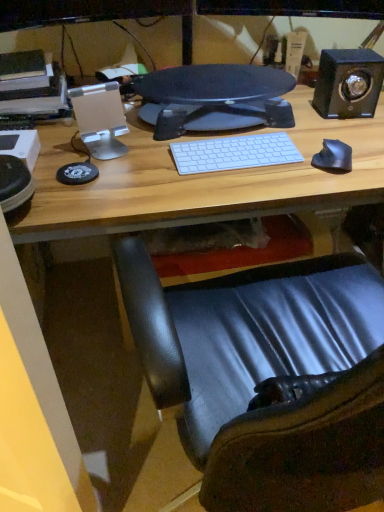
Find the location of a particular element. The width and height of the screenshot is (384, 512). free location in front of black matte speaker at upper right is located at coordinates (344, 133).